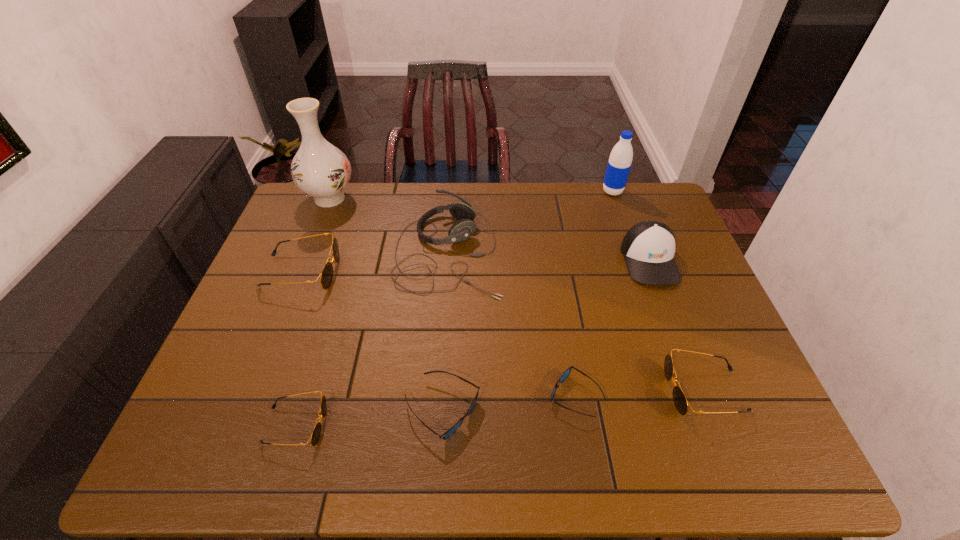
The width and height of the screenshot is (960, 540). I want to click on vase situated at the left edge, so click(321, 170).

Where is `sunglasses that is at the left edge`? This screenshot has height=540, width=960. sunglasses that is at the left edge is located at coordinates (326, 276).

You are a GUI agent. You are given a task and a screenshot of the screen. Output one action in this format:
    pyautogui.click(x=<x>, y=<y>)
    Task: Click on the water bottle located in the right edge section of the desktop
    The image size is (960, 540).
    Given the screenshot: What is the action you would take?
    pyautogui.click(x=620, y=160)

Find the location of a particular element. This screenshot has height=540, width=960. cap at the right edge is located at coordinates (648, 247).

Locate an element on the screen. The height and width of the screenshot is (540, 960). sunglasses situated at the right edge is located at coordinates (680, 401).

Where is `object located in the far left corner section of the desktop`? object located in the far left corner section of the desktop is located at coordinates (321, 170).

This screenshot has width=960, height=540. Identify the location of object that is positioned at the far right corner. (620, 160).

Locate an element on the screen. The image size is (960, 540). free space at the far edge of the desktop is located at coordinates (387, 202).

I want to click on vacant space at the near edge, so click(373, 429).

Image resolution: width=960 pixels, height=540 pixels. I want to click on vacant space at the right edge of the desktop, so click(x=676, y=240).